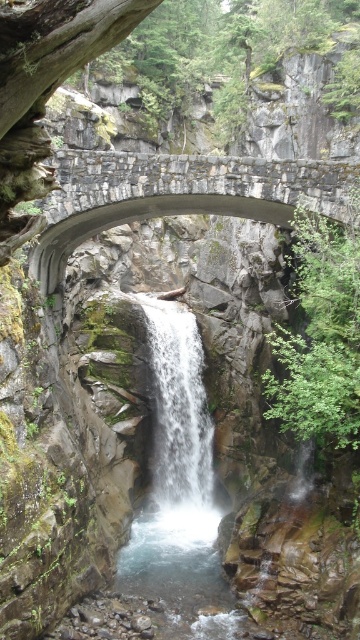
Is rustic stone bridge at center above white frothy water at center?

Correct, rustic stone bridge at center is located above white frothy water at center.

Does point (249, 192) lie in front of point (176, 506)?

Yes, point (249, 192) is in front of point (176, 506).

Who is more forward, (228,180) or (165,428)?

Point (228,180) is more forward.

Identify the location of rustic stone bridge at center. The width and height of the screenshot is (360, 640). (176, 195).